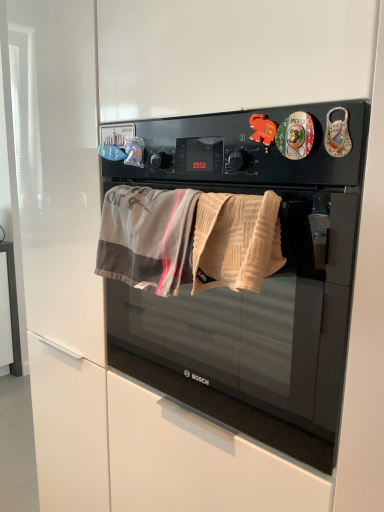
Question: Based on their positions, is beige textured towel at center, the 1th beach towel from the right, located to the left or right of gray cotton beach towel at center, which appears as the first beach towel when viewed from the left?

Choices:
 (A) left
 (B) right

Answer: (B)

Question: Which is correct: beige textured towel at center, the 1th beach towel from the right, is inside gray cotton beach towel at center, the second beach towel from the right, or outside of it?

Choices:
 (A) inside
 (B) outside

Answer: (B)

Question: Which is farther from the beige textured towel at center, the 1th beach towel from the right?

Choices:
 (A) gray cotton beach towel at center, the second beach towel from the right
 (B) black matte microwave oven at center

Answer: (B)

Question: Estimate the real-world distances between objects in this image. Which object is closer to the black matte microwave oven at center?

Choices:
 (A) gray cotton beach towel at center, the second beach towel from the right
 (B) beige textured towel at center, which ranks as the second beach towel in left-to-right order

Answer: (A)